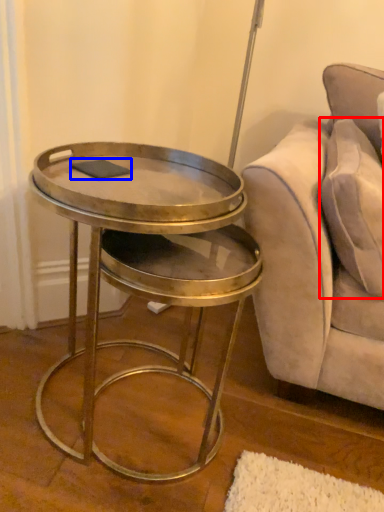
Question: Which of the following is the closest to the observer, pillow (highlighted by a red box) or pad (highlighted by a blue box)?

Choices:
 (A) pillow
 (B) pad

Answer: (A)